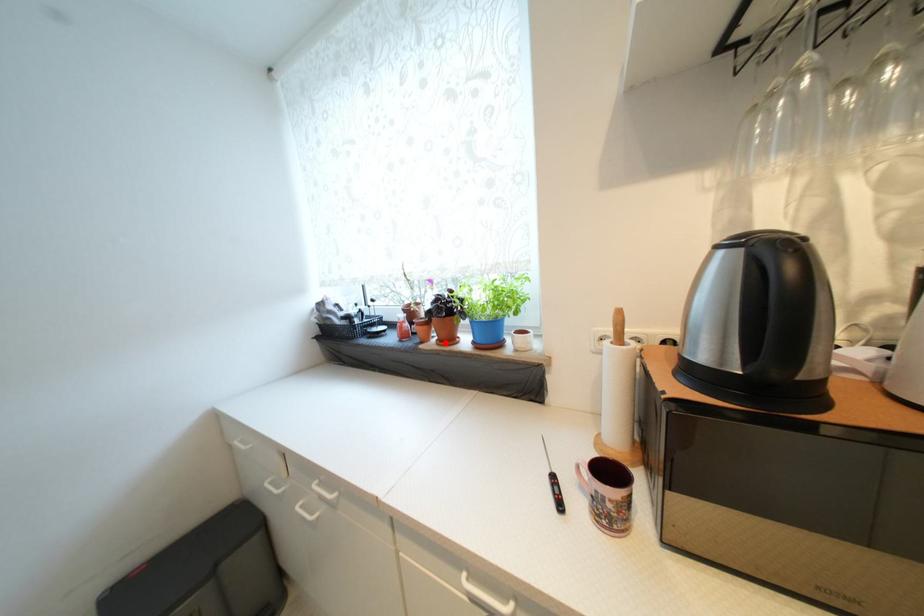
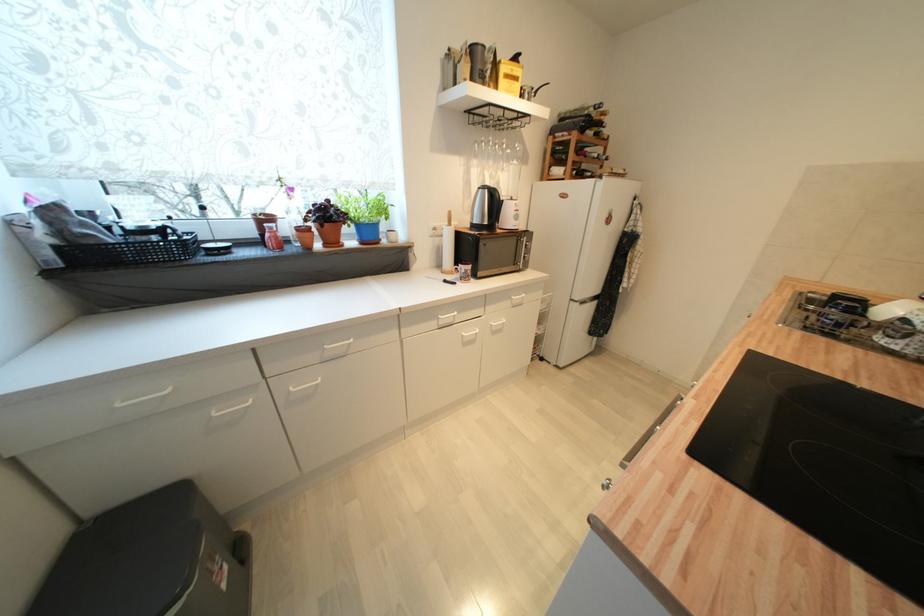
Question: I am providing you with two images of the same scene from different viewpoints. A red point is marked on the first image. At the location where the point appears in image 1, is it still visible in image 2?

Choices:
 (A) Yes
 (B) No

Answer: (A)